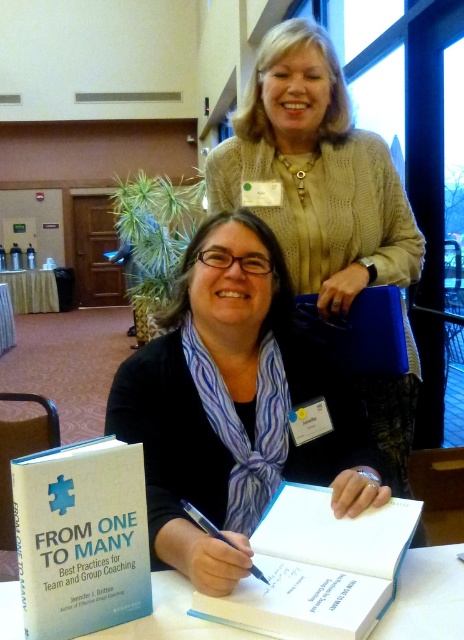
Question: Is the position of black matte scarf at center more distant than that of white paper at center?

Choices:
 (A) yes
 (B) no

Answer: (A)

Question: Which of the following is the farthest from the observer?

Choices:
 (A) black matte scarf at center
 (B) black metallic pen at center
 (C) white tablecloth at lower left
 (D) white paper at center

Answer: (C)

Question: Is knitted beige sweater at upper center above black metallic pen at center?

Choices:
 (A) no
 (B) yes

Answer: (B)

Question: From the image, what is the correct spatial relationship of knitted beige sweater at upper center in relation to white tablecloth at lower left?

Choices:
 (A) below
 (B) above

Answer: (A)

Question: Which object is positioned farthest from the white paper at center?

Choices:
 (A) black metallic pen at center
 (B) black matte scarf at center

Answer: (B)

Question: Which object appears closest to the camera in this image?

Choices:
 (A) white paper at center
 (B) white tablecloth at lower left

Answer: (A)